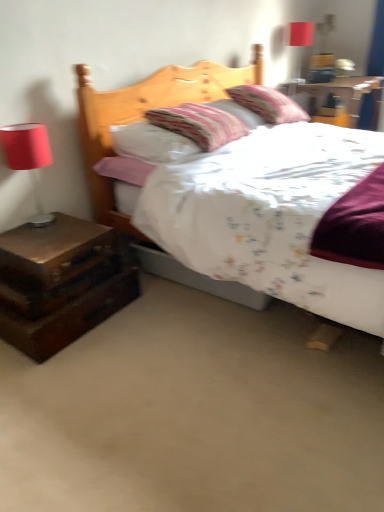
Question: Is matte red lampshade at left a part of wooden nightstand at upper right, the 3th nightstand when ordered from front to back?

Choices:
 (A) yes
 (B) no

Answer: (B)

Question: Does wooden nightstand at upper right, which is the first nightstand from right to left, have a larger size compared to matte red lampshade at left?

Choices:
 (A) no
 (B) yes

Answer: (B)

Question: Is wooden nightstand at upper right, the 1th nightstand positioned from the back, not close to matte red lampshade at left?

Choices:
 (A) no
 (B) yes

Answer: (B)

Question: Does wooden nightstand at upper right, which is the first nightstand from right to left, have a greater height compared to matte red lampshade at left?

Choices:
 (A) no
 (B) yes

Answer: (A)

Question: Does wooden nightstand at upper right, the 3th nightstand ordered from the bottom, have a smaller size compared to matte red lampshade at left?

Choices:
 (A) no
 (B) yes

Answer: (A)

Question: Is wooden nightstand at upper right, which is the first nightstand from right to left, in front of or behind matte red lampshade at upper right in the image?

Choices:
 (A) behind
 (B) front

Answer: (B)

Question: Does point (377, 86) appear closer or farther from the camera than point (302, 35)?

Choices:
 (A) closer
 (B) farther

Answer: (A)

Question: Visually, is wooden nightstand at upper right, arranged as the 1th nightstand when viewed from the top, positioned to the left or to the right of matte red lampshade at upper right?

Choices:
 (A) right
 (B) left

Answer: (A)

Question: From a real-world perspective, relative to matte red lampshade at upper right, is wooden nightstand at upper right, the 1th nightstand positioned from the back, vertically above or below?

Choices:
 (A) below
 (B) above

Answer: (A)

Question: In terms of width, does dark wood nightstand at lower left, arranged as the first nightstand when ordered from the bottom, look wider or thinner when compared to matte red lampshade at left?

Choices:
 (A) thin
 (B) wide

Answer: (B)

Question: From the image's perspective, relative to matte red lampshade at left, is dark wood nightstand at lower left, which appears as the second nightstand when viewed from the right, above or below?

Choices:
 (A) above
 (B) below

Answer: (B)

Question: From a real-world perspective, is dark wood nightstand at lower left, which appears as the second nightstand when viewed from the right, positioned above or below matte red lampshade at left?

Choices:
 (A) above
 (B) below

Answer: (B)

Question: In terms of height, does dark wood nightstand at lower left, the 3th nightstand positioned from the top, look taller or shorter compared to matte red lampshade at left?

Choices:
 (A) short
 (B) tall

Answer: (A)

Question: Looking at their shapes, would you say brown wooden nightstand at left, the first nightstand in the front-to-back sequence, is wider or thinner than matte red lampshade at upper right?

Choices:
 (A) thin
 (B) wide

Answer: (B)

Question: Is brown wooden nightstand at left, the second nightstand positioned from the bottom, bigger or smaller than matte red lampshade at upper right?

Choices:
 (A) small
 (B) big

Answer: (B)